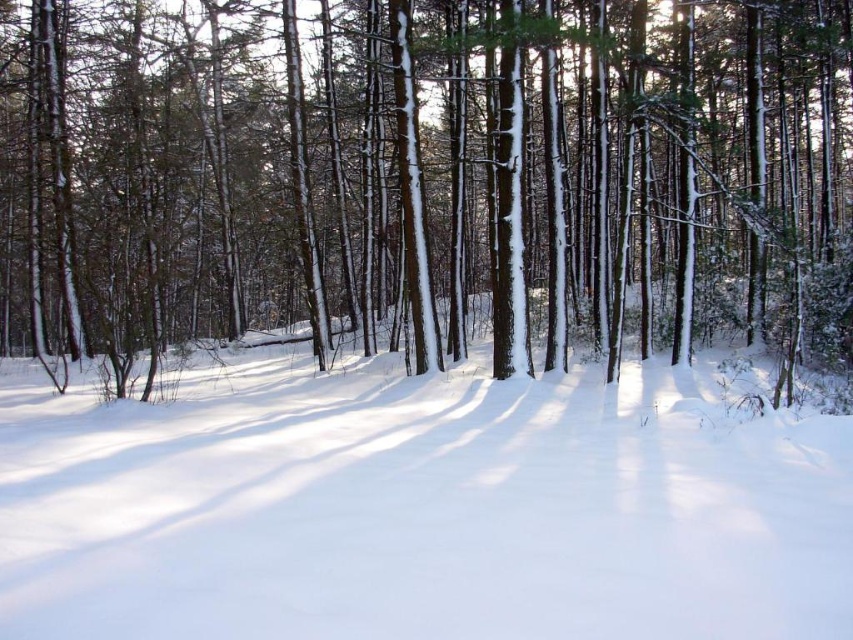
Question: Which object appears closest to the camera in this image?

Choices:
 (A) smooth bark tree at center
 (B) white fluffy snow at center

Answer: (B)

Question: Can you confirm if smooth bark tree at center is bigger than white fluffy snow at center?

Choices:
 (A) no
 (B) yes

Answer: (B)

Question: Which object appears closest to the camera in this image?

Choices:
 (A) smooth bark tree at center
 (B) white fluffy snow at center

Answer: (B)

Question: Which object is farther from the camera taking this photo?

Choices:
 (A) white fluffy snow at center
 (B) smooth bark tree at center

Answer: (B)

Question: Is smooth bark tree at center thinner than white fluffy snow at center?

Choices:
 (A) no
 (B) yes

Answer: (A)

Question: Is smooth bark tree at center below white fluffy snow at center?

Choices:
 (A) no
 (B) yes

Answer: (A)